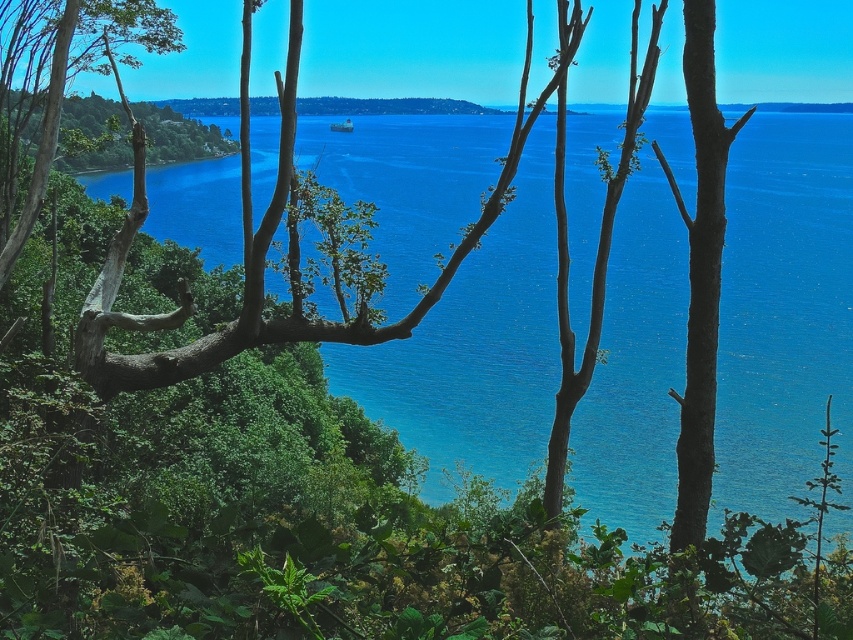
Is blue water at center taller than green leafy tree at left?

Yes.

Between blue water at center and green leafy tree at left, which one appears on the left side from the viewer's perspective?

green leafy tree at left

Is point (634, 472) positioned in front of point (21, 220)?

No, (634, 472) is further to viewer.

Identify the location of blue water at center. The image size is (853, 640). (784, 310).

From the picture: Can you confirm if blue water at center is positioned above brown rough bark tree at right?

Actually, blue water at center is below brown rough bark tree at right.

Which is behind, point (733, 168) or point (705, 51)?

The point (733, 168) is more distant.

At what (x,y) coordinates should I click in order to perform the action: click on blue water at center. Please return your answer as a coordinate pair (x, y). Looking at the image, I should click on pyautogui.click(x=784, y=310).

Measure the distance from brown rough bark tree at right to green leafy tree at left.

A distance of 8.36 meters exists between brown rough bark tree at right and green leafy tree at left.

Does brown rough bark tree at right come behind green leafy tree at left?

No.

Is point (695, 275) closer to viewer compared to point (109, 29)?

Yes, it is.

Find the location of a particular element. brown rough bark tree at right is located at coordinates pyautogui.click(x=700, y=275).